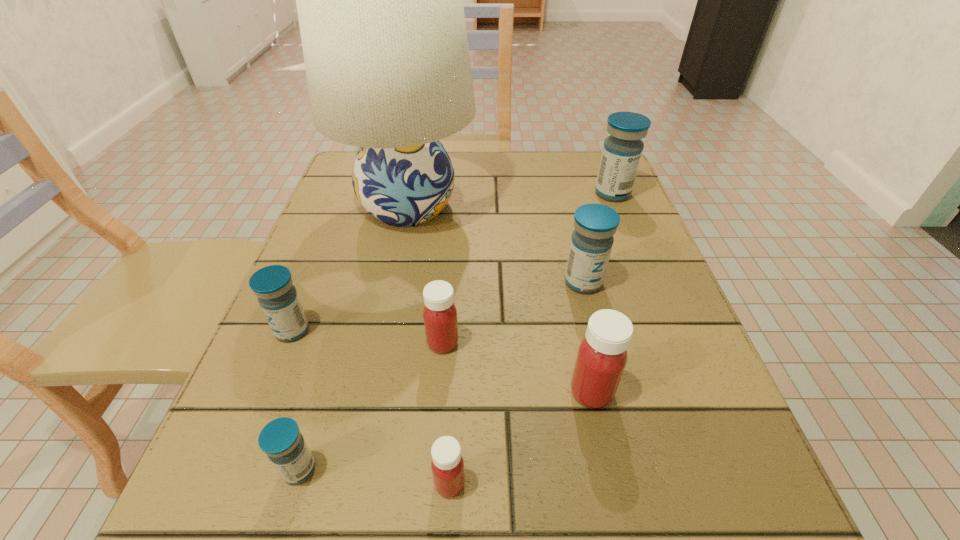
At what (x,y) coordinates should I click in order to perform the action: click on empty space that is in between the lampshade and the third farthest blue medicine. Please return your answer as a coordinate pair (x, y). Looking at the image, I should click on (350, 268).

Locate an element on the screen. blank region between the third biggest blue medicine and the sixth medicine from right to left is located at coordinates (296, 400).

You are a GUI agent. You are given a task and a screenshot of the screen. Output one action in this format:
    pyautogui.click(x=<x>, y=<y>)
    Task: Click on the closest object to the second nearest blue medicine
    This screenshot has width=960, height=540.
    Given the screenshot: What is the action you would take?
    pyautogui.click(x=380, y=6)

Choose which object is the third nearest neighbor to the biggest red medicine. Please provide its 2D coordinates. Your answer should be formatted as a tuple, i.e. [(x, y)], where the tuple contains the x and y coordinates of a point satisfying the conditions above.

[(447, 465)]

Select which medicine appears as the closest to the tallest object. Please provide its 2D coordinates. Your answer should be formatted as a tuple, i.e. [(x, y)], where the tuple contains the x and y coordinates of a point satisfying the conditions above.

[(592, 239)]

Select which medicine appears as the fourth closest to the nearest red medicine. Please provide its 2D coordinates. Your answer should be formatted as a tuple, i.e. [(x, y)], where the tuple contains the x and y coordinates of a point satisfying the conditions above.

[(277, 296)]

Find the location of a particular element. the closest blue medicine to the smallest blue medicine is located at coordinates (277, 296).

The width and height of the screenshot is (960, 540). In order to click on blue medicine object that ranks as the third closest to the second smallest blue medicine in this screenshot , I will do `click(622, 150)`.

Select which red medicine appears as the third closest to the leftmost medicine. Please provide its 2D coordinates. Your answer should be formatted as a tuple, i.e. [(x, y)], where the tuple contains the x and y coordinates of a point satisfying the conditions above.

[(602, 355)]

Select which red medicine appears as the closest to the smallest red medicine. Please provide its 2D coordinates. Your answer should be formatted as a tuple, i.e. [(x, y)], where the tuple contains the x and y coordinates of a point satisfying the conditions above.

[(602, 355)]